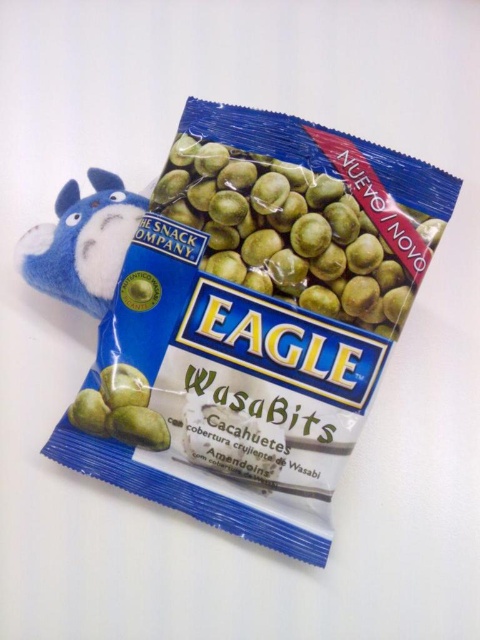
You are holding a ruler and want to measure the distance between the green matte wasabits at center and yourself. If the ruler is 30 cm long, how many rulers do you need to span the distance?

The distance between the green matte wasabits at center and the viewer is 1.29 meters. Since each ruler is 30 cm, you would need 1.29 meters divided by 0.3 meters per ruler, which equals approximately 4.3 rulers. Therefore, you would need 5 rulers to cover the entire distance.

What is located at the point with coordinates (301, 227) on the snack package?

The point (301, 227) corresponds to the green matte wasabits at center.

You are a quality control inspector examining the packaging of a new snack product. You notice the green matte wasabits at center and the blue plush toy at upper left. Based on the packaging layout, which object would appear larger to a customer viewing the product from the front?

The green matte wasabits at center appears larger than the blue plush toy at upper left because it is taller.